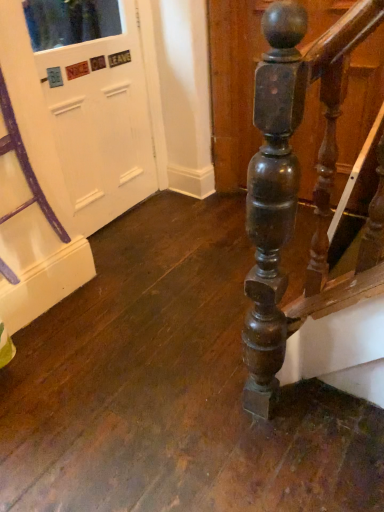
What is the approximate height of white matte door at upper left?

white matte door at upper left is 3.73 feet tall.

The width and height of the screenshot is (384, 512). What are the coordinates of `white matte door at upper left` in the screenshot? It's located at (95, 103).

What do you see at coordinates (95, 103) in the screenshot? I see `white matte door at upper left` at bounding box center [95, 103].

Locate an element on the screen. The width and height of the screenshot is (384, 512). white matte door at upper left is located at coordinates (95, 103).